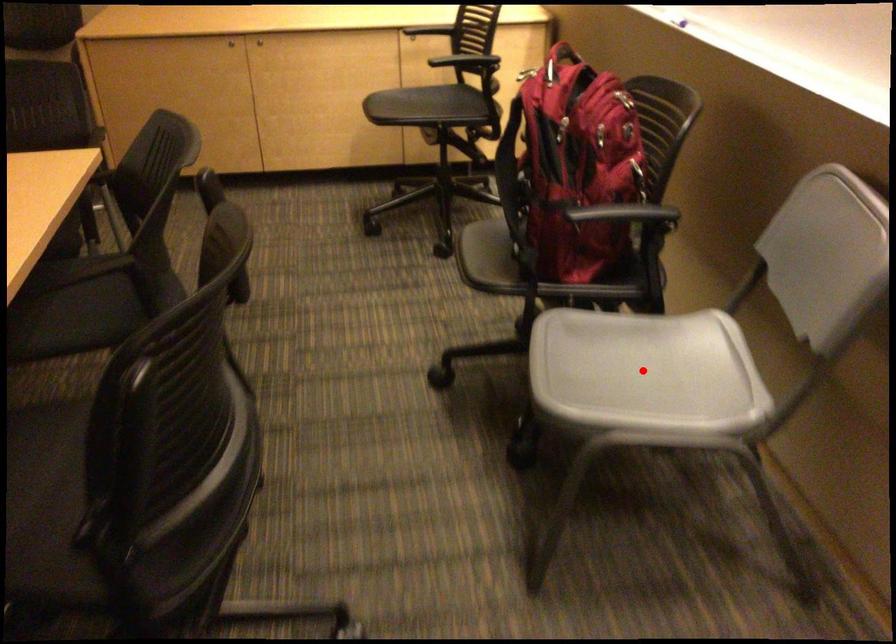
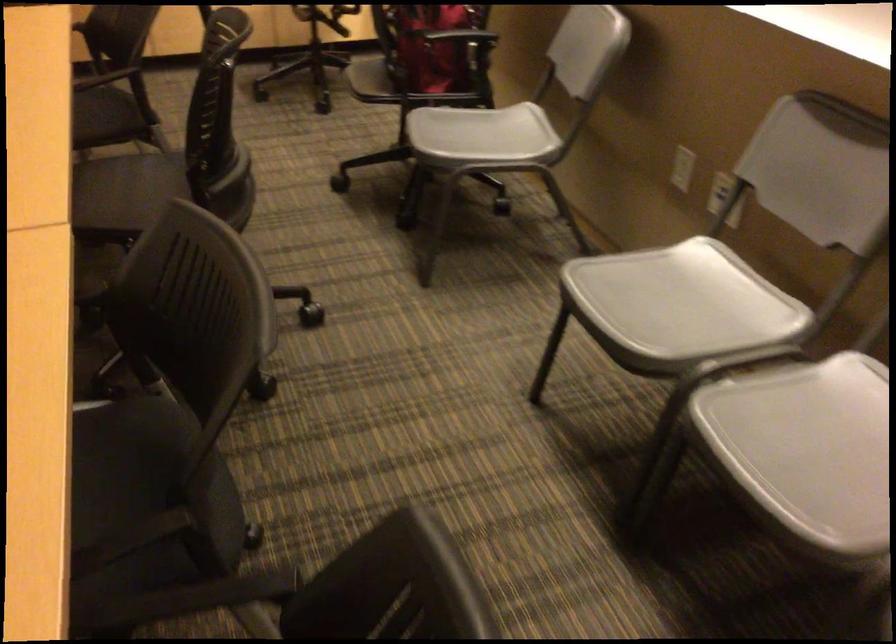
Where in the second image is the point corresponding to the highlighted location from the first image?

(481, 136)